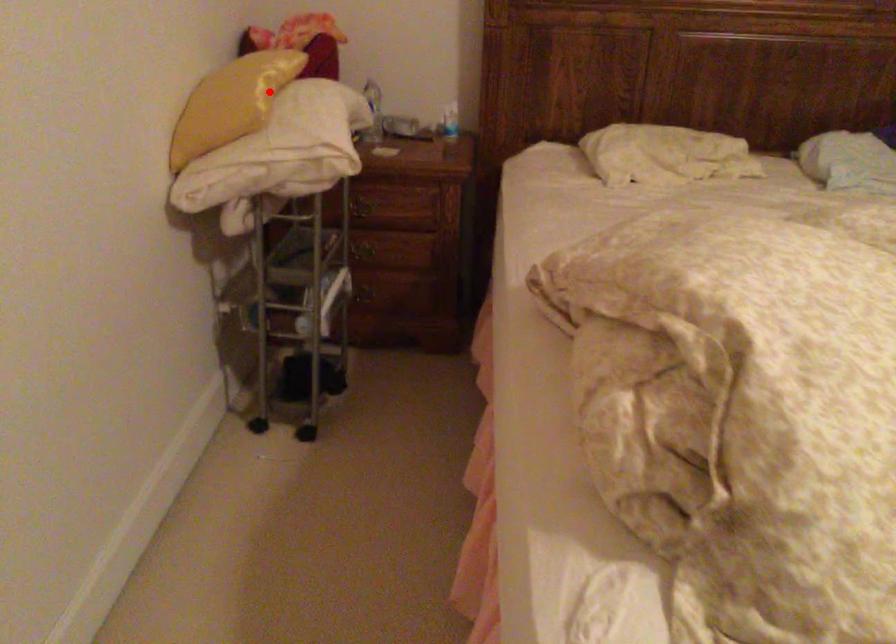
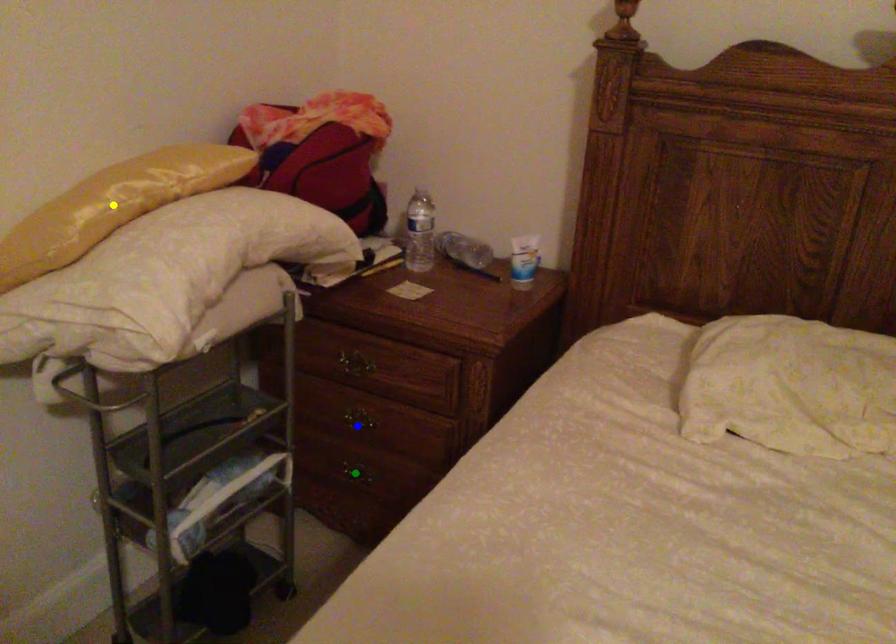
Question: I am providing you with two images of the same scene from different viewpoints. A red point is marked on the first image. You are given multiple points on the second image. Which spot in image 2 lines up with the point in image 1?

Choices:
 (A) yellow point
 (B) blue point
 (C) green point

Answer: (A)